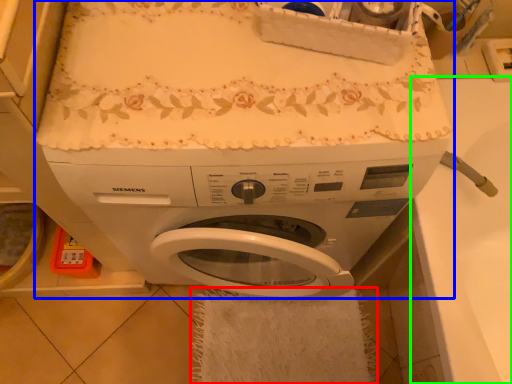
Question: Estimate the real-world distances between objects in this image. Which object is farther from bath towel (highlighted by a red box), washing machine (highlighted by a blue box) or counter top (highlighted by a green box)?

Choices:
 (A) washing machine
 (B) counter top

Answer: (B)